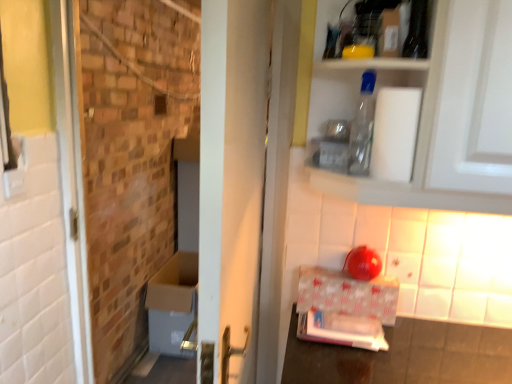
Image resolution: width=512 pixels, height=384 pixels. In order to click on free point above white glossy cardboard box at lower right (from a real-world perspective) in this screenshot , I will do `click(345, 269)`.